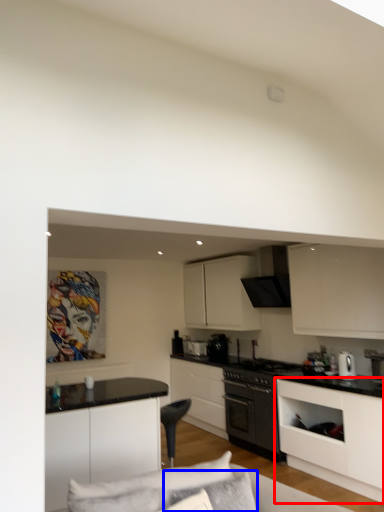
Question: Among these objects, which one is farthest to the camera, cabinetry (highlighted by a red box) or pillow (highlighted by a blue box)?

Choices:
 (A) cabinetry
 (B) pillow

Answer: (A)